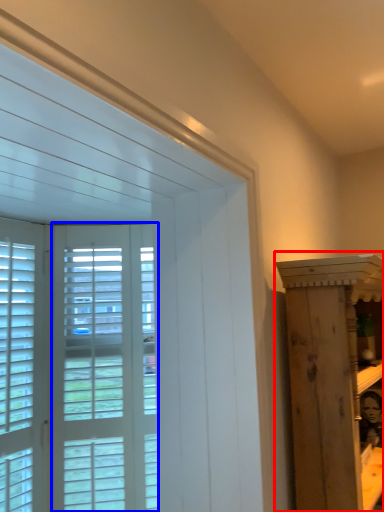
Question: Which of the following is the farthest to the observer, furniture (highlighted by a red box) or screen door (highlighted by a blue box)?

Choices:
 (A) furniture
 (B) screen door

Answer: (B)